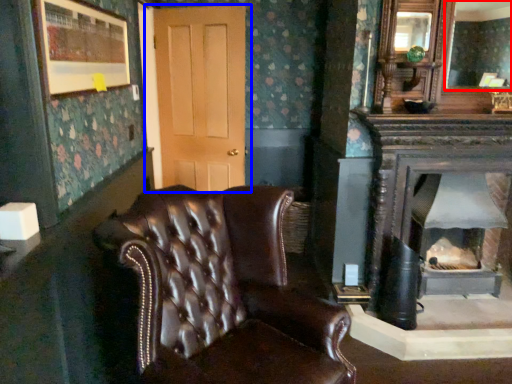
Question: Which point is further to the camera, mirror (highlighted by a red box) or door (highlighted by a blue box)?

Choices:
 (A) mirror
 (B) door

Answer: (B)